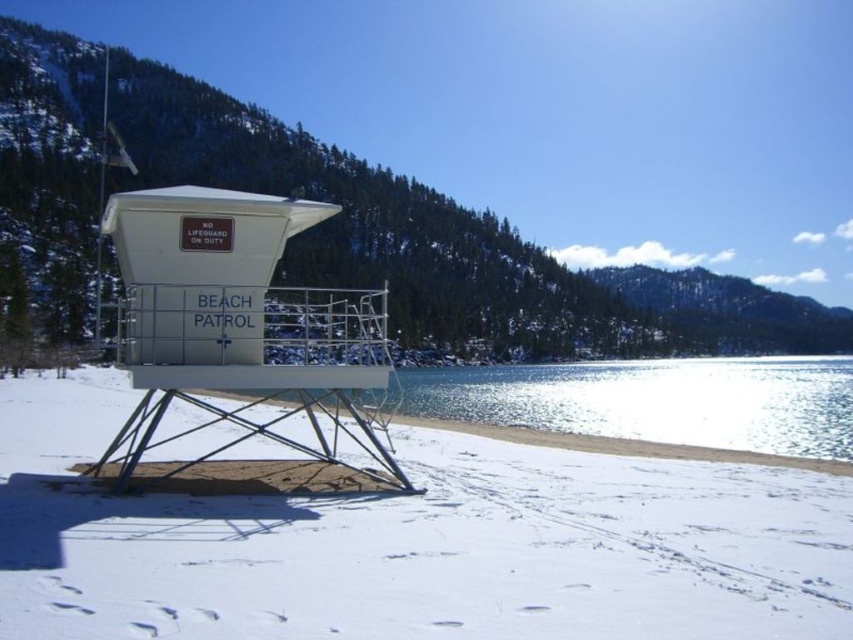
Measure the distance from white powdery snow at lower center to glistening ice water at center.

white powdery snow at lower center and glistening ice water at center are 35.10 meters apart.

Who is more forward, [186,532] or [763,419]?

Point [186,532] is in front.

Describe the element at coordinates (415, 545) in the screenshot. I see `white powdery snow at lower center` at that location.

Where is `white powdery snow at lower center`? The image size is (853, 640). white powdery snow at lower center is located at coordinates (415, 545).